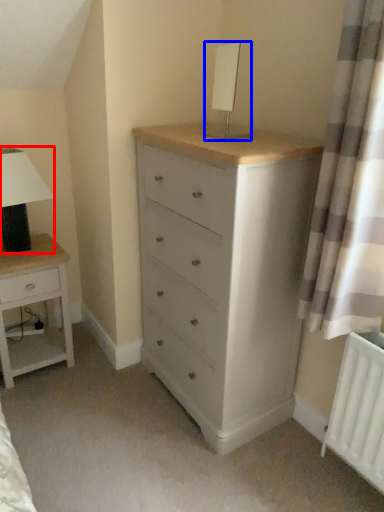
Question: Which object is closer to the camera taking this photo, table lamp (highlighted by a red box) or table lamp (highlighted by a blue box)?

Choices:
 (A) table lamp
 (B) table lamp

Answer: (B)